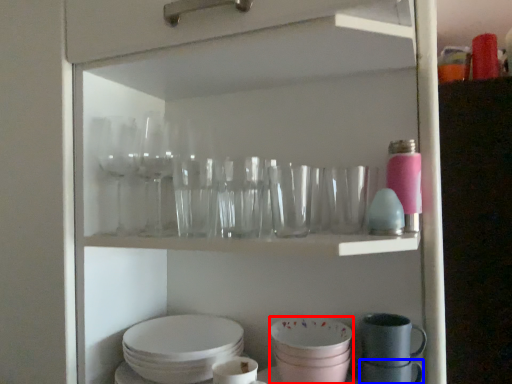
Question: Which object is further to the camera taking this photo, tableware (highlighted by a red box) or tableware (highlighted by a blue box)?

Choices:
 (A) tableware
 (B) tableware

Answer: (B)